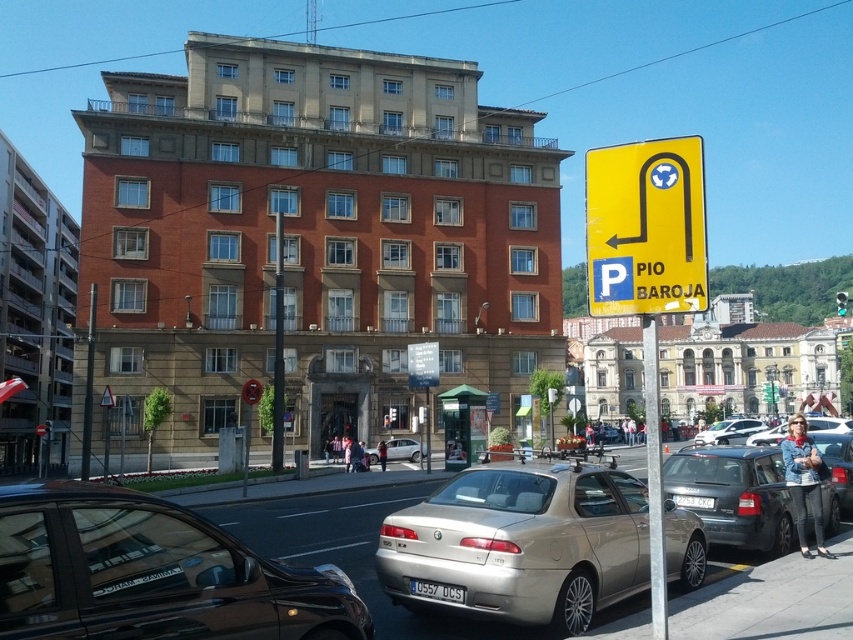
Question: Is gold metallic sedan at center thinner than metallic pole at right?

Choices:
 (A) yes
 (B) no

Answer: (A)

Question: Can you confirm if gold metallic sedan at center is smaller than satin silver sedan at center?

Choices:
 (A) yes
 (B) no

Answer: (A)

Question: Among these objects, which one is farthest from the camera?

Choices:
 (A) gold metallic sedan at center
 (B) shiny black sedan at lower left
 (C) satin silver sedan at center

Answer: (C)

Question: Is shiny black sedan at lower left in front of silver metallic sedan at center?

Choices:
 (A) yes
 (B) no

Answer: (A)

Question: Which is farther from the yellow plastic parking sign at upper right?

Choices:
 (A) silver metallic sedan at center
 (B) gold metallic sedan at center

Answer: (A)

Question: Estimate the real-world distances between objects in this image. Which object is farther from the gold metallic sedan at center?

Choices:
 (A) metallic pole at right
 (B) silver metallic sedan at center
 (C) metallic gray hatchback at center

Answer: (B)